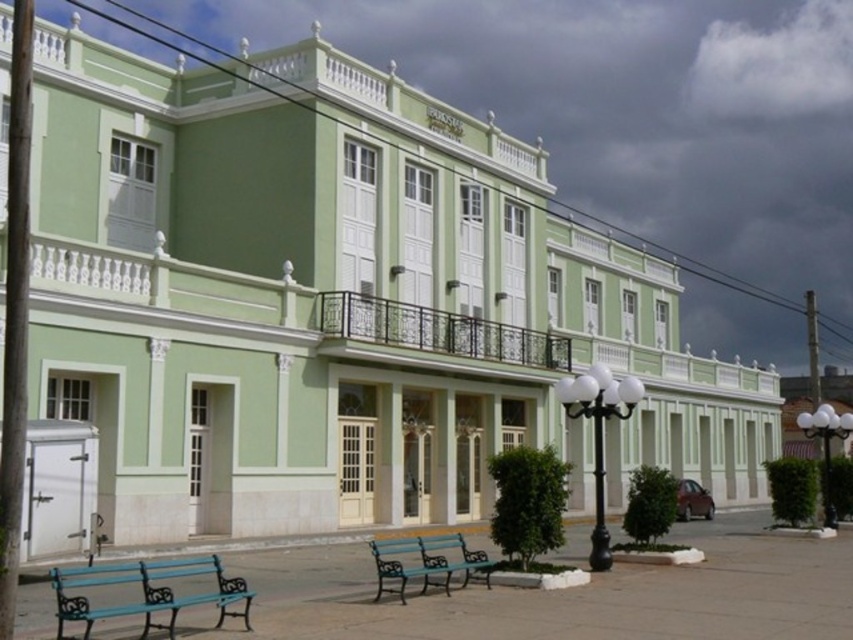
You are a visitor standing in front of the building and want to sit on the teal painted wood bench at lower left. Is there enough space between the bench and the white glass lamp post at right for you to walk past the bench comfortably?

The teal painted wood bench at lower left occupies less space than the white glass lamp post at right, so there is enough space between them for you to walk past comfortably.

You are a maintenance worker who needs to replace the light bulb on the black metal streetlight at center. The teal painted wood bench at center is directly beneath the streetlight. Can you stand on the bench to reach the light bulb without needing a ladder?

The black metal streetlight at center is taller than the teal painted wood bench at center, so you can stand on the teal painted wood bench at center to reach the light bulb on the black metal streetlight at center.

You are standing in front of the two story building and want to sit on the teal painted wood bench at center. To reach it, you must walk past the black metal streetlight at center. Is the streetlight closer to you or farther away than the bench?

The black metal streetlight at center is further to the viewer than the teal painted wood bench at center, so the streetlight is farther away from you than the bench. Therefore, you would pass the streetlight before reaching the bench.